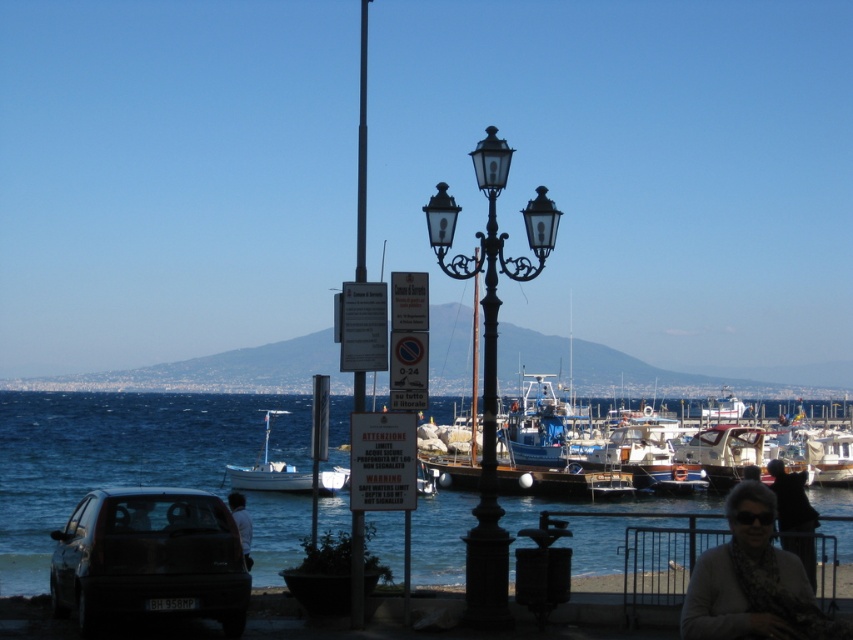
Is point (490, 170) farther from viewer compared to point (242, 476)?

No, (490, 170) is in front of (242, 476).

How far apart are black wrought iron streetlight at center and white matte boat at center?

black wrought iron streetlight at center is 25.70 meters from white matte boat at center.

Describe the element at coordinates (489, 356) in the screenshot. The width and height of the screenshot is (853, 640). I see `black wrought iron streetlight at center` at that location.

Identify the location of black wrought iron streetlight at center. pyautogui.click(x=489, y=356).

Which is in front, point (498, 598) or point (782, 506)?

Positioned in front is point (498, 598).

Does black wrought iron streetlight at center have a greater width compared to black fur cat at lower right?

No.

Locate an element on the screen. black wrought iron streetlight at center is located at coordinates (489, 356).

Who is taller, black fur cat at lower right or dark gray fabric jacket at lower center?

black fur cat at lower right

How distant is black fur cat at lower right from dark gray fabric jacket at lower center?

black fur cat at lower right is 7.45 meters from dark gray fabric jacket at lower center.

Where is `black fur cat at lower right`? black fur cat at lower right is located at coordinates (791, 499).

You are a GUI agent. You are given a task and a screenshot of the screen. Output one action in this format:
    pyautogui.click(x=<x>, y=<y>)
    Task: Click on the black fur cat at lower right
    This screenshot has width=853, height=640.
    Given the screenshot: What is the action you would take?
    pyautogui.click(x=791, y=499)